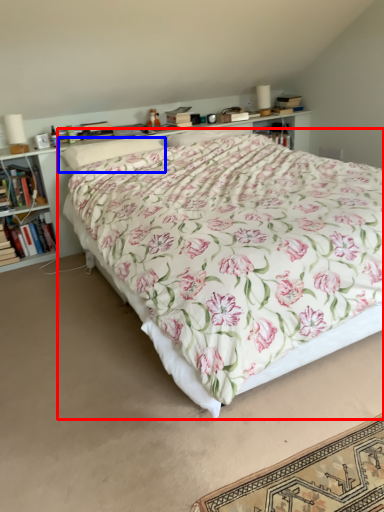
Question: Which of the following is the farthest to the observer, bed (highlighted by a red box) or pillow (highlighted by a blue box)?

Choices:
 (A) bed
 (B) pillow

Answer: (B)